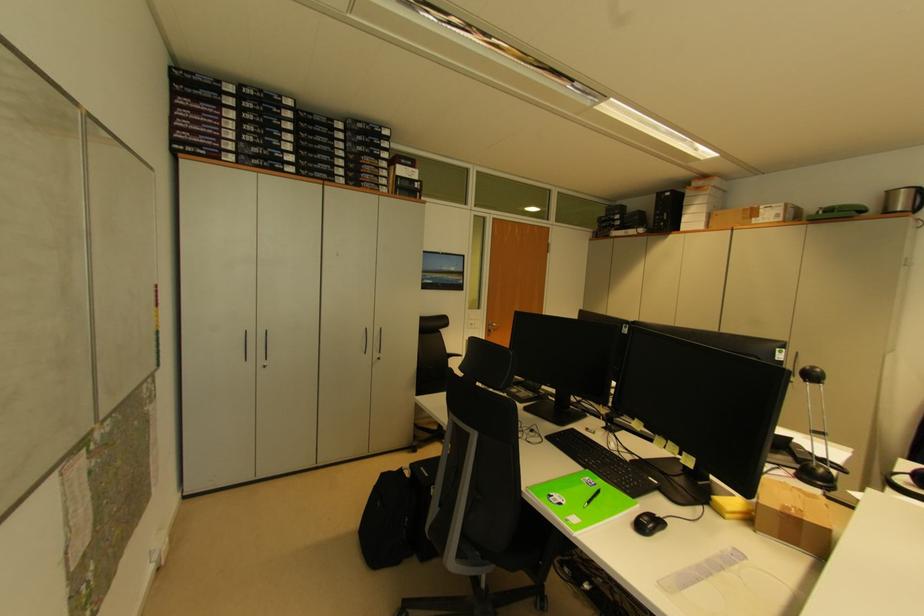
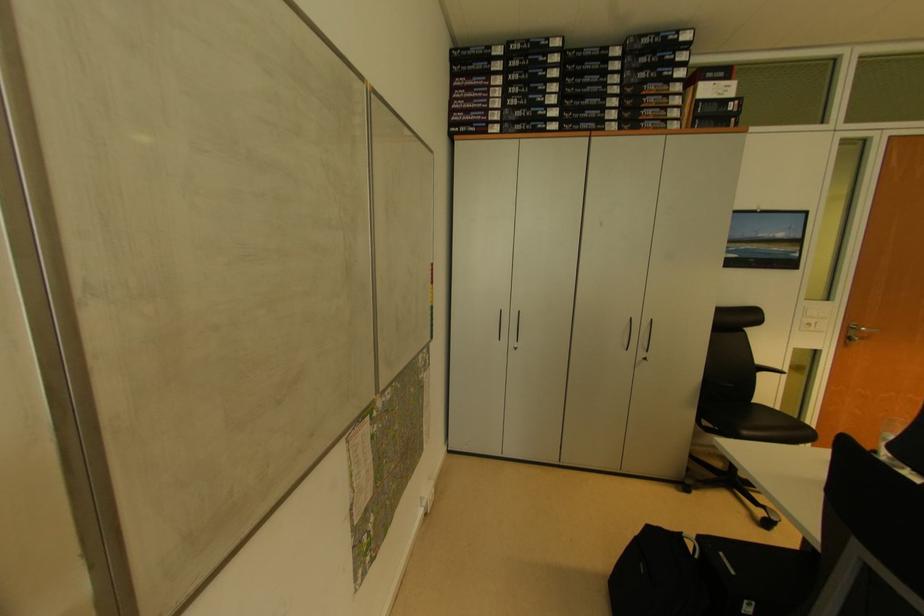
Where in the second image is the point corresponding to point (365, 185) from the first image?

(646, 124)